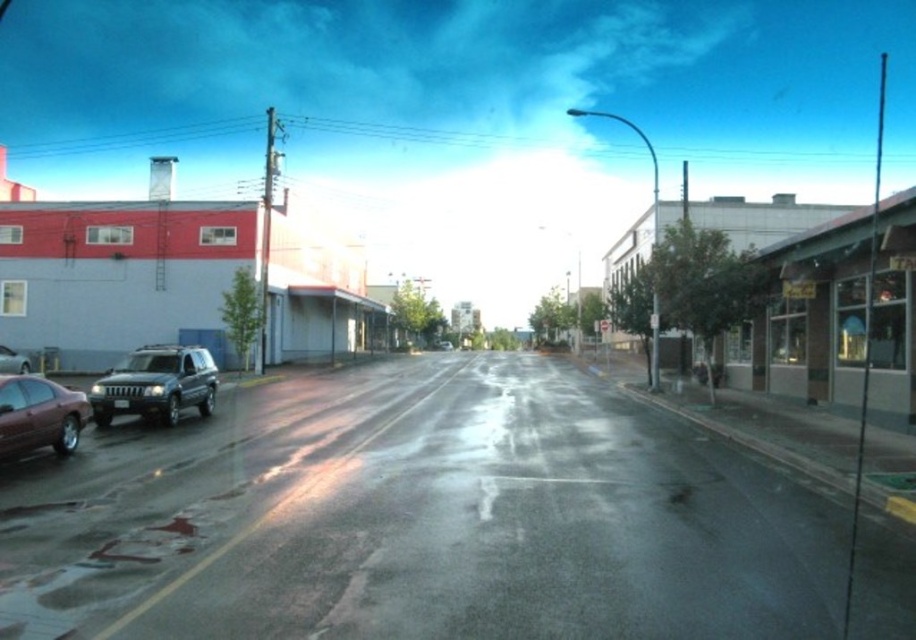
You are a delivery person trying to park your 1.8 meters tall delivery box in the space between the shiny maroon sedan at lower left and the shiny silver sedan at left. Can the delivery box fit vertically between them?

The shiny maroon sedan at lower left is much taller than the shiny silver sedan at left. The height difference between them may leave enough space for the delivery box, but since the exact vertical clearance isn

You are a delivery person who needs to park your van between the metallic gray suv at left and the shiny silver sedan at left. Is there enough space between them to fit your van?

The metallic gray suv at left is positioned over shiny silver sedan at left, meaning they are parked one in front of the other. Since they are not side by side, there is no space between them for your van to park between.